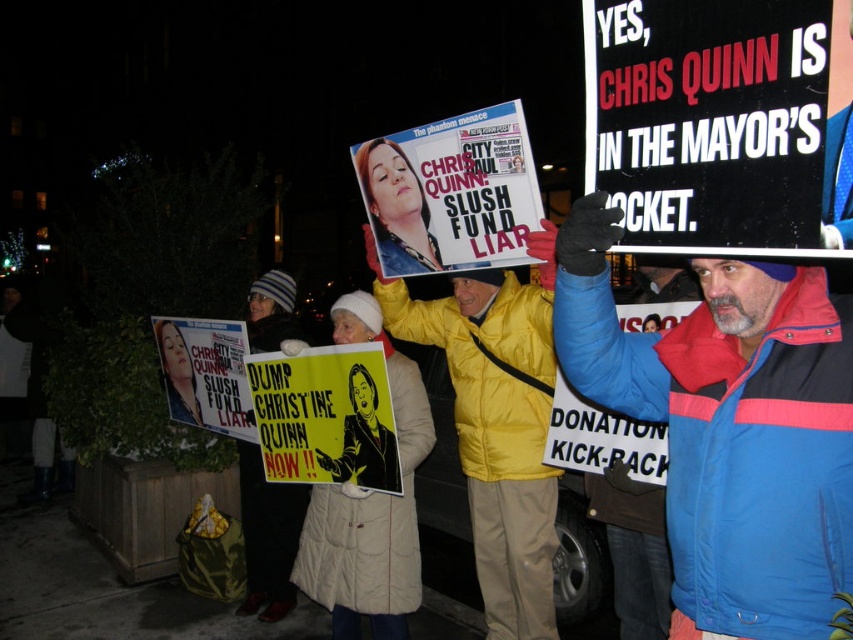
You are a photographer trying to capture the yellow puffy jacket at center and the yellow paper poster at center in a single frame. Based on their positions, which object should you focus on first to ensure both are in the shot?

The yellow puffy jacket at center is below the yellow paper poster at center, so you should focus on the yellow paper poster at center first to ensure both are in the frame.